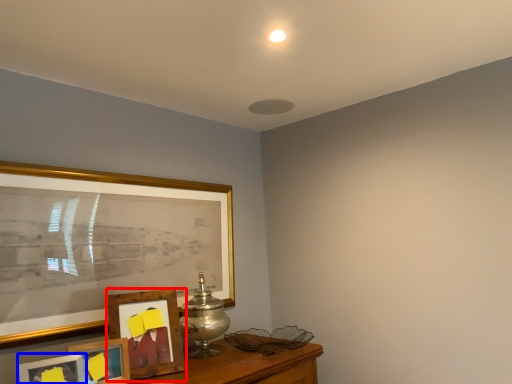
Question: Which object is closer to the camera taking this photo, picture frame (highlighted by a red box) or picture frame (highlighted by a blue box)?

Choices:
 (A) picture frame
 (B) picture frame

Answer: (B)